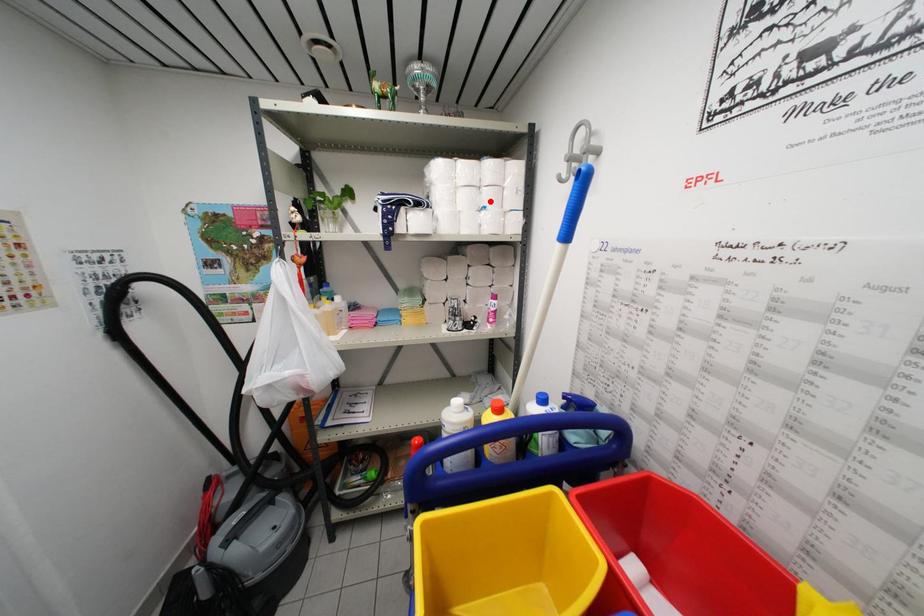
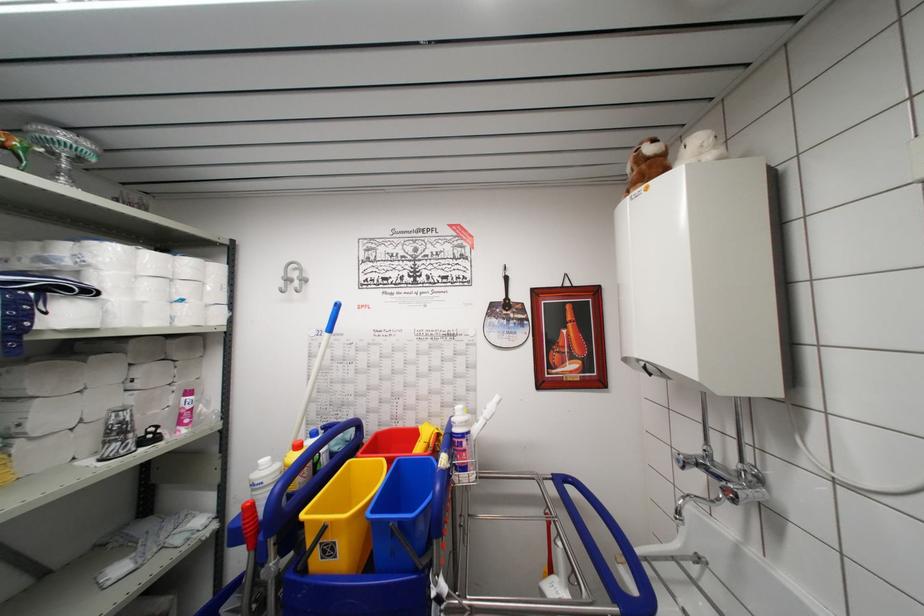
Find the pixel in the second image that matches the highlighted location in the first image.

(188, 294)